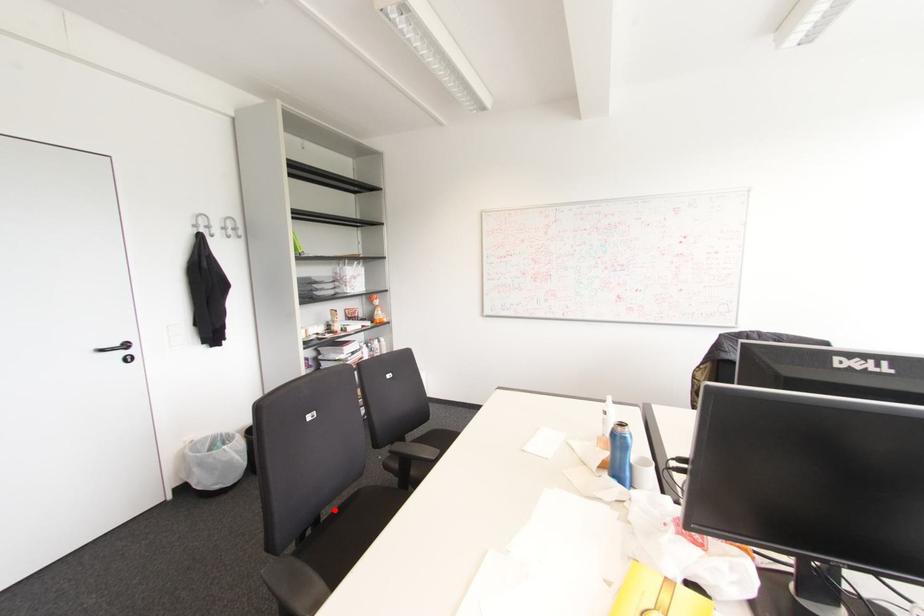
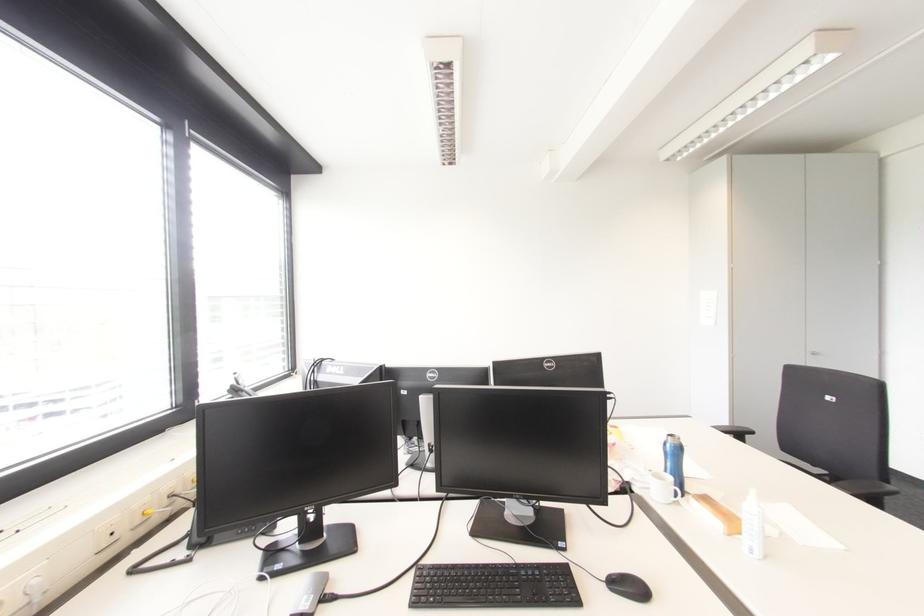
Question: I am providing you with two images of the same scene from different viewpoints. A red point is marked on the first image. Can you still see the location of the red point in image 2?

Choices:
 (A) Yes
 (B) No

Answer: (B)